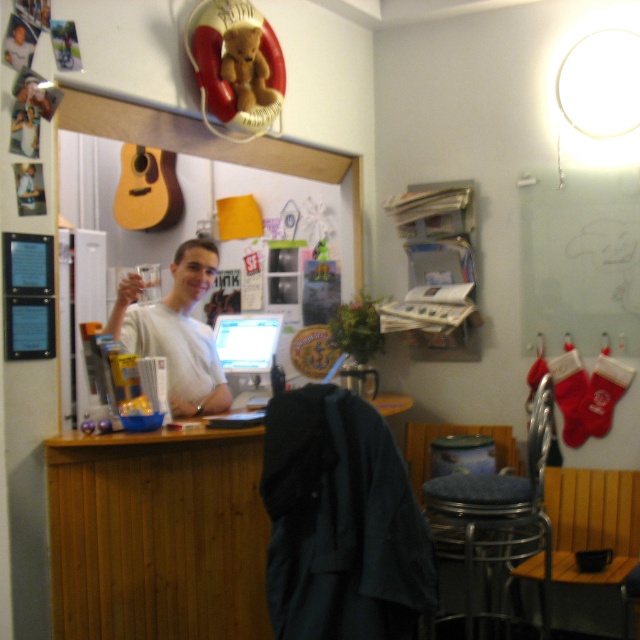
Question: Does metallic stool at lower center come behind white matte shirt at center?

Choices:
 (A) no
 (B) yes

Answer: (A)

Question: Which point appears farthest from the camera in this image?

Choices:
 (A) (118, 448)
 (B) (477, 500)
 (C) (250, 371)
 (D) (182, 244)

Answer: (C)

Question: Is white matte shirt at center thinner than matte plastic computer at center?

Choices:
 (A) yes
 (B) no

Answer: (B)

Question: Which point is farther from the camera taking this photo?

Choices:
 (A) (480, 493)
 (B) (269, 340)
 (C) (262, 630)

Answer: (B)

Question: Which object is the closest to the metallic stool at lower center?

Choices:
 (A) wooden table at center
 (B) white matte shirt at center

Answer: (A)

Question: Does wooden table at center appear on the right side of white matte shirt at center?

Choices:
 (A) no
 (B) yes

Answer: (B)